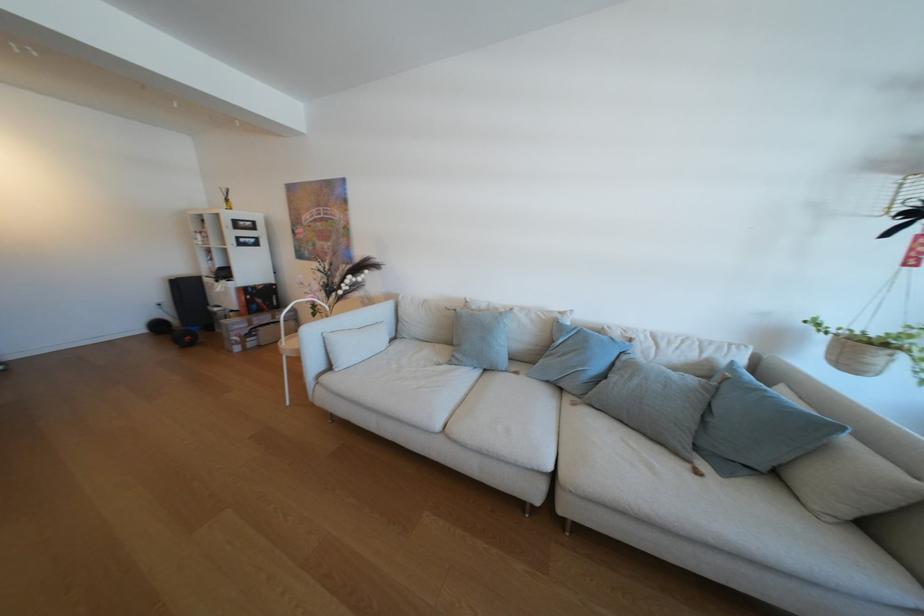
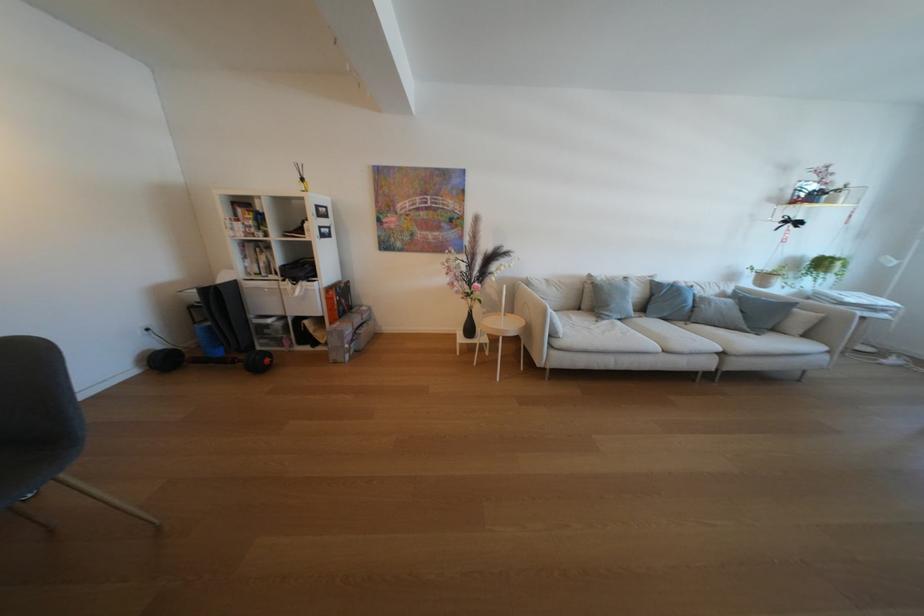
Question: What movement of the cameraman would produce the second image?

Choices:
 (A) Left
 (B) Right
 (C) Forward
 (D) Backward

Answer: (A)